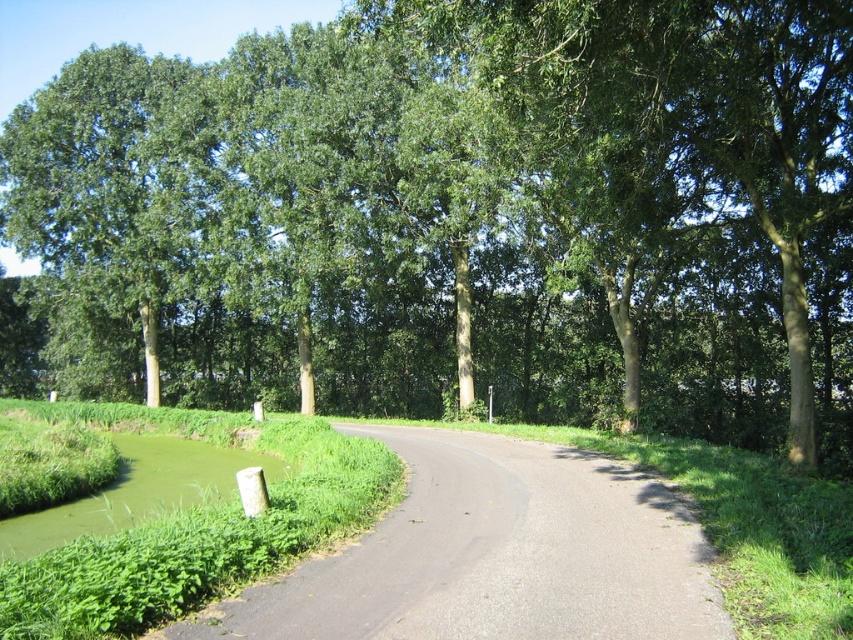
You are a hiker standing on the green grassy bank at lower left and want to reach the green leafy tree at center. Which direction should you move to get there?

To reach the green leafy tree at center from the green grassy bank at lower left, you should move upward since the green leafy tree at center is located above the green grassy bank at lower left.

You are driving a car on the road and want to reach a destination located at point (366, 547). There is an obstacle at point (569, 365). Can you safely pass the obstacle and reach your destination?

Point (569, 365) is behind point (366, 547), so the obstacle is behind your destination. You can safely pass the obstacle and reach your destination.